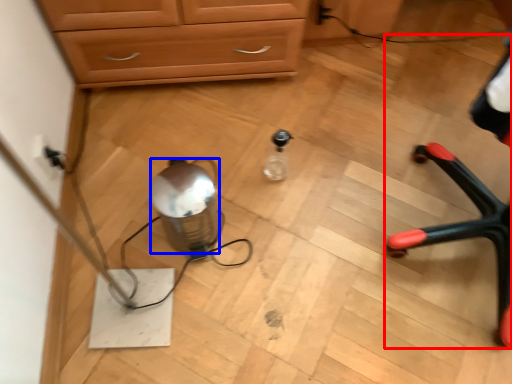
Question: Among these objects, which one is nearest to the camera, armchair (highlighted by a red box) or water (highlighted by a blue box)?

Choices:
 (A) armchair
 (B) water

Answer: (A)